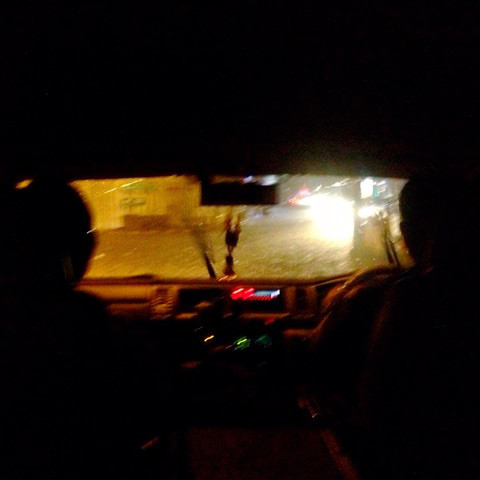
Identify the location of red lights. Image resolution: width=480 pixels, height=480 pixels. (240, 295), (259, 300).